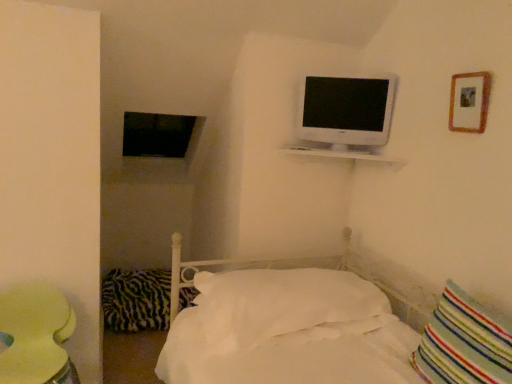
Question: Is zebra-patterned fabric pillow at lower left, marked as the first pillow in a left-to-right arrangement, positioned with its back to wooden picture frame at upper right?

Choices:
 (A) no
 (B) yes

Answer: (A)

Question: From the image's perspective, is zebra-patterned fabric pillow at lower left, positioned as the third pillow in front-to-back order, below wooden picture frame at upper right?

Choices:
 (A) no
 (B) yes

Answer: (B)

Question: Is zebra-patterned fabric pillow at lower left, marked as the first pillow in a left-to-right arrangement, outside of wooden picture frame at upper right?

Choices:
 (A) yes
 (B) no

Answer: (A)

Question: Is zebra-patterned fabric pillow at lower left, which is counted as the 1th pillow, starting from the back, at the right side of wooden picture frame at upper right?

Choices:
 (A) yes
 (B) no

Answer: (B)

Question: Is zebra-patterned fabric pillow at lower left, which is counted as the 1th pillow, starting from the back, behind wooden picture frame at upper right?

Choices:
 (A) no
 (B) yes

Answer: (B)

Question: Based on their sizes in the image, would you say matte yellow table at lower left is bigger or smaller than white soft pillow at center, which ranks as the second pillow in back-to-front order?

Choices:
 (A) small
 (B) big

Answer: (A)

Question: In terms of width, does matte yellow table at lower left look wider or thinner when compared to white soft pillow at center, which is the second pillow from front to back?

Choices:
 (A) wide
 (B) thin

Answer: (B)

Question: Considering their positions, is matte yellow table at lower left located in front of or behind white soft pillow at center, which ranks as the second pillow in back-to-front order?

Choices:
 (A) behind
 (B) front

Answer: (B)

Question: From a real-world perspective, is matte yellow table at lower left positioned above or below white soft pillow at center, which ranks as the second pillow in back-to-front order?

Choices:
 (A) above
 (B) below

Answer: (B)

Question: Is white glossy shelf at upper center taller or shorter than white soft pillow at center, which ranks as the second pillow in left-to-right order?

Choices:
 (A) short
 (B) tall

Answer: (A)

Question: In terms of width, does white glossy shelf at upper center look wider or thinner when compared to white soft pillow at center, which ranks as the second pillow in left-to-right order?

Choices:
 (A) wide
 (B) thin

Answer: (B)

Question: In the image, is white glossy shelf at upper center positioned in front of or behind white soft pillow at center, which ranks as the second pillow in left-to-right order?

Choices:
 (A) front
 (B) behind

Answer: (B)

Question: From the image's perspective, is white glossy shelf at upper center located above or below white soft pillow at center, placed as the second pillow when sorted from right to left?

Choices:
 (A) above
 (B) below

Answer: (A)

Question: Visually, is white glossy shelf at upper center positioned to the left or to the right of striped fabric pillow at lower right, which is the third pillow in back-to-front order?

Choices:
 (A) left
 (B) right

Answer: (A)

Question: From the image's perspective, relative to striped fabric pillow at lower right, which is the third pillow in back-to-front order, is white glossy shelf at upper center above or below?

Choices:
 (A) below
 (B) above

Answer: (B)